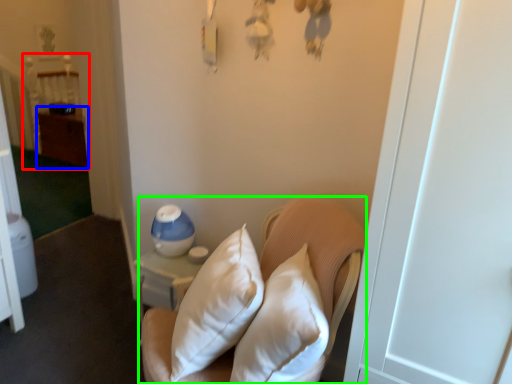
Question: Estimate the real-world distances between objects in this image. Which object is closer to bed (highlighted by a red box), dresser (highlighted by a blue box) or furniture (highlighted by a green box)?

Choices:
 (A) dresser
 (B) furniture

Answer: (A)